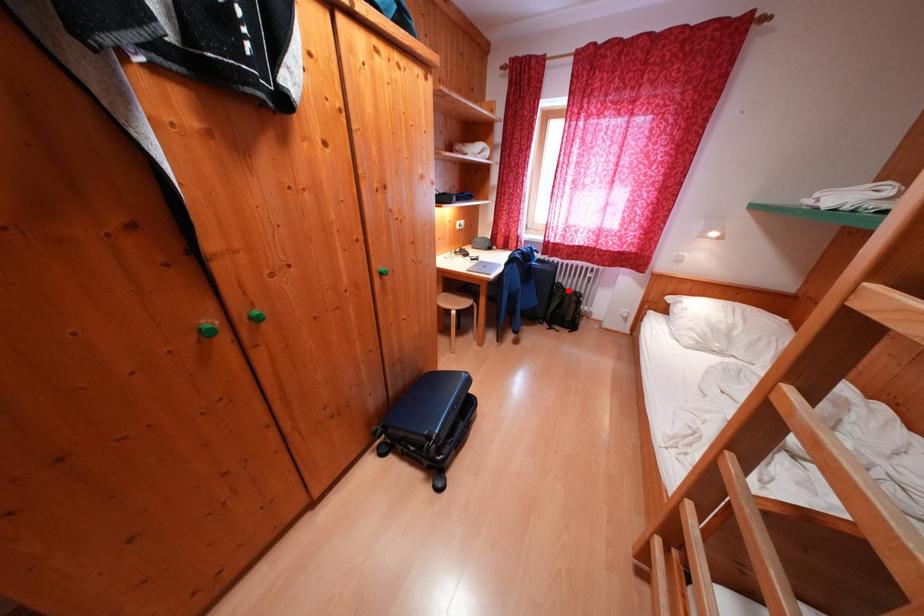
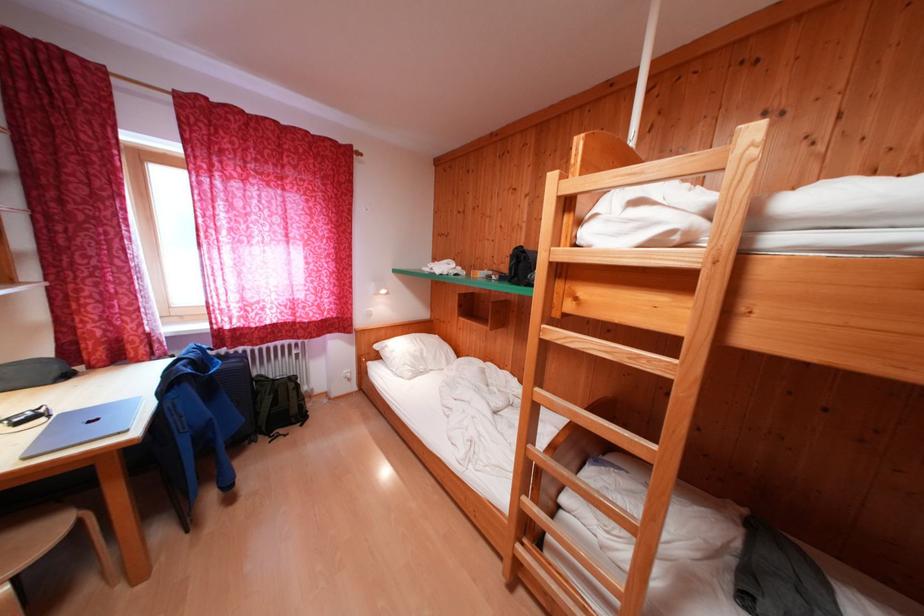
Where in the second image is the point corresponding to the highlighted location from the first image?

(271, 383)